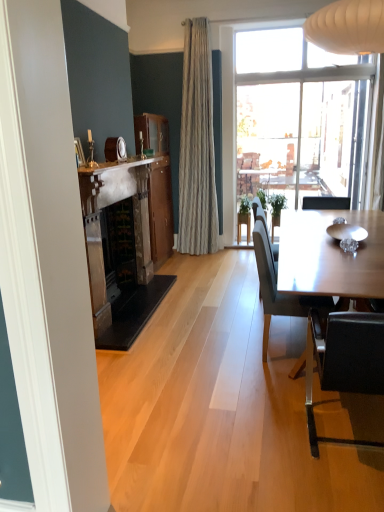
Question: Is the depth of white marble fireplace at upper center greater than that of wooden picture frame at upper left?

Choices:
 (A) no
 (B) yes

Answer: (A)

Question: From a real-world perspective, does white marble fireplace at upper center sit lower than wooden picture frame at upper left?

Choices:
 (A) yes
 (B) no

Answer: (A)

Question: Is white marble fireplace at upper center completely or partially outside of wooden picture frame at upper left?

Choices:
 (A) no
 (B) yes

Answer: (B)

Question: From the image's perspective, is white marble fireplace at upper center over wooden picture frame at upper left?

Choices:
 (A) yes
 (B) no

Answer: (A)

Question: Does white marble fireplace at upper center have a greater height compared to wooden picture frame at upper left?

Choices:
 (A) yes
 (B) no

Answer: (B)

Question: Is point (157, 145) closer or farther from the camera than point (100, 162)?

Choices:
 (A) closer
 (B) farther

Answer: (B)

Question: Relative to white marble fireplace at upper center, is mahogany wood cabinet at center in front or behind?

Choices:
 (A) behind
 (B) front

Answer: (A)

Question: Considering the positions of mahogany wood cabinet at center and white marble fireplace at upper center in the image, is mahogany wood cabinet at center taller or shorter than white marble fireplace at upper center?

Choices:
 (A) short
 (B) tall

Answer: (B)

Question: From a real-world perspective, is mahogany wood cabinet at center above or below white marble fireplace at upper center?

Choices:
 (A) above
 (B) below

Answer: (B)

Question: From the image's perspective, is dark gray fabric chair at right, marked as the 2th chair in a front-to-back arrangement, positioned above or below black leather chair at lower right, which appears as the second chair when viewed from the back?

Choices:
 (A) above
 (B) below

Answer: (A)

Question: Looking at their shapes, would you say dark gray fabric chair at right, marked as the 2th chair in a front-to-back arrangement, is wider or thinner than black leather chair at lower right, which appears as the second chair when viewed from the back?

Choices:
 (A) wide
 (B) thin

Answer: (B)

Question: Based on their sizes in the image, would you say dark gray fabric chair at right, marked as the 2th chair in a front-to-back arrangement, is bigger or smaller than black leather chair at lower right, acting as the 1th chair starting from the front?

Choices:
 (A) small
 (B) big

Answer: (B)

Question: Is dark gray fabric chair at right, marked as the 2th chair in a front-to-back arrangement, spatially inside black leather chair at lower right, which appears as the second chair when viewed from the back, or outside of it?

Choices:
 (A) outside
 (B) inside

Answer: (A)

Question: Would you say green matte plant at center is inside or outside dark gray fabric chair at right, marked as the 2th chair in a front-to-back arrangement?

Choices:
 (A) outside
 (B) inside

Answer: (A)

Question: Considering the positions of green matte plant at center and dark gray fabric chair at right, positioned as the 1th chair in back-to-front order, in the image, is green matte plant at center bigger or smaller than dark gray fabric chair at right, positioned as the 1th chair in back-to-front order,?

Choices:
 (A) small
 (B) big

Answer: (A)